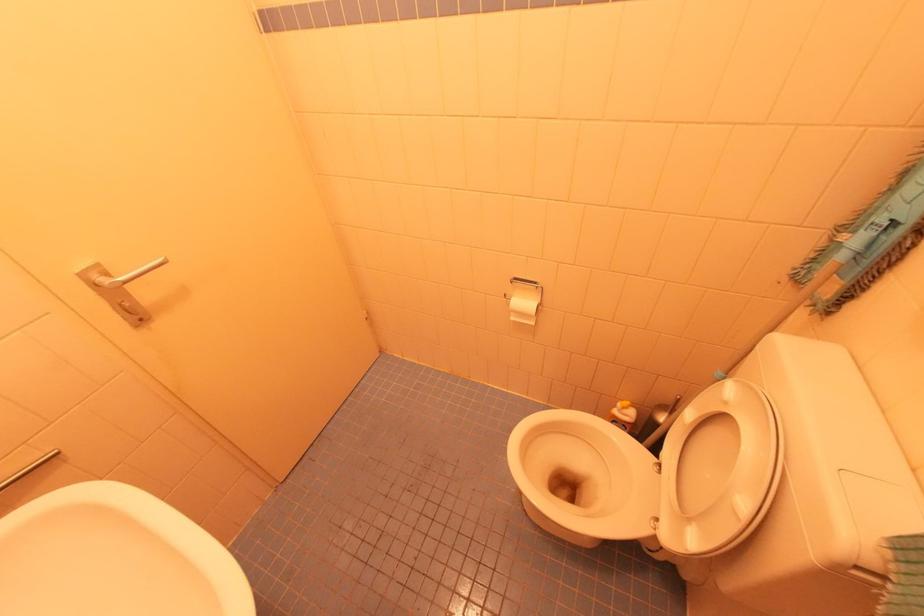
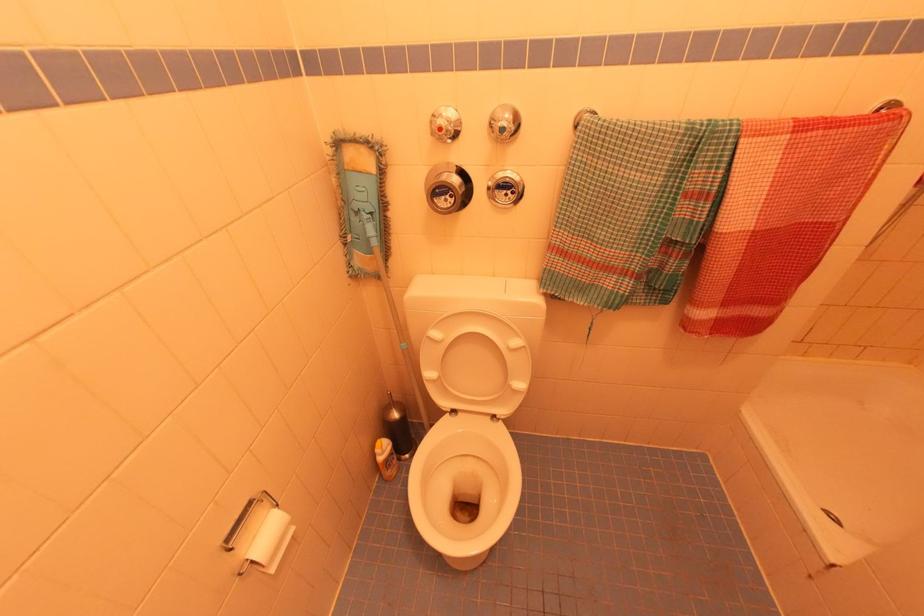
Find the pixel in the second image that matches (x=736, y=382) in the first image.

(433, 329)